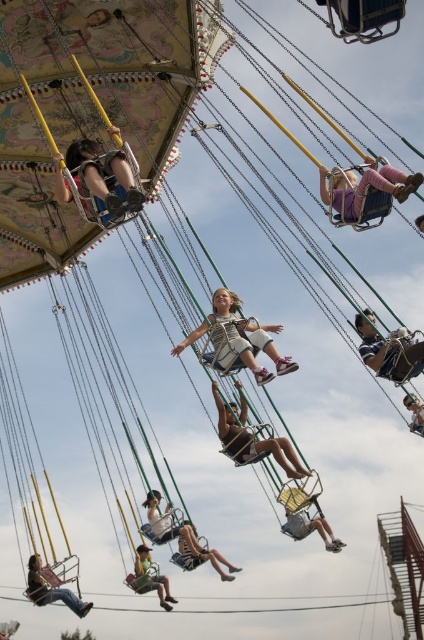
You are a maintenance worker at the amusement park. You need to inspect the pink fabric swing at upper center and the denim shorts at center. Given that your inspection tool has a maximum reach of 50 meters, can you safely inspect both objects without moving closer?

The distance between the pink fabric swing at upper center and the denim shorts at center is 58.47 meters. Since the inspection tool only reaches up to 50 meters, you cannot safely inspect both objects without moving closer.

You are a photographer standing at the front of the swing ride. You want to take a photo of the metallic silver helmet at center and the green fabric swing at lower left. Which object will appear larger in your photo?

The metallic silver helmet at center will appear larger in the photo because it is closer to the viewer than the green fabric swing at lower left.